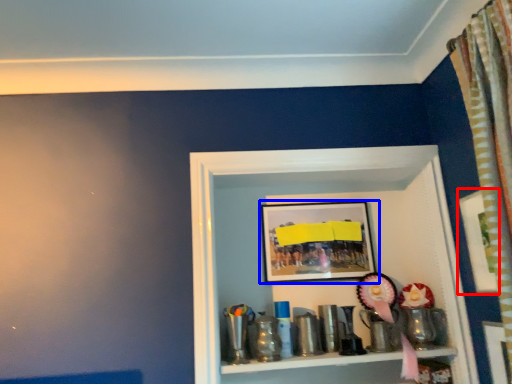
Question: Which object appears closest to the camera in this image, picture frame (highlighted by a red box) or picture frame (highlighted by a blue box)?

Choices:
 (A) picture frame
 (B) picture frame

Answer: (A)